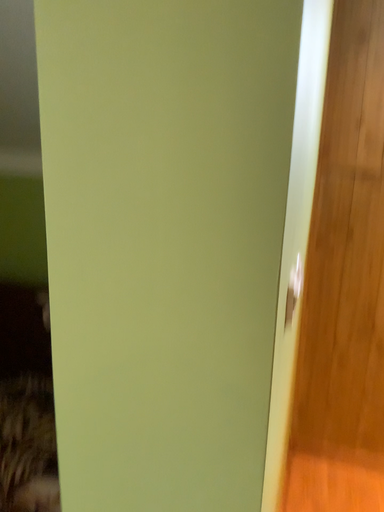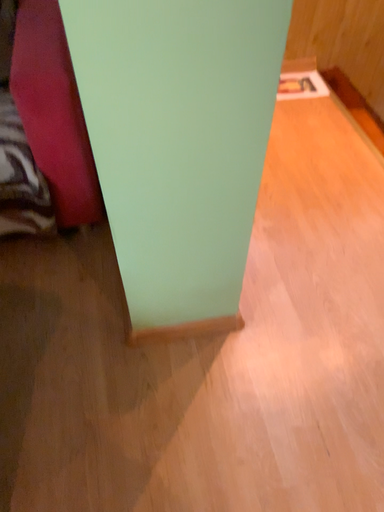
Question: Which way did the camera rotate in the video?

Choices:
 (A) rotated left
 (B) rotated right

Answer: (B)